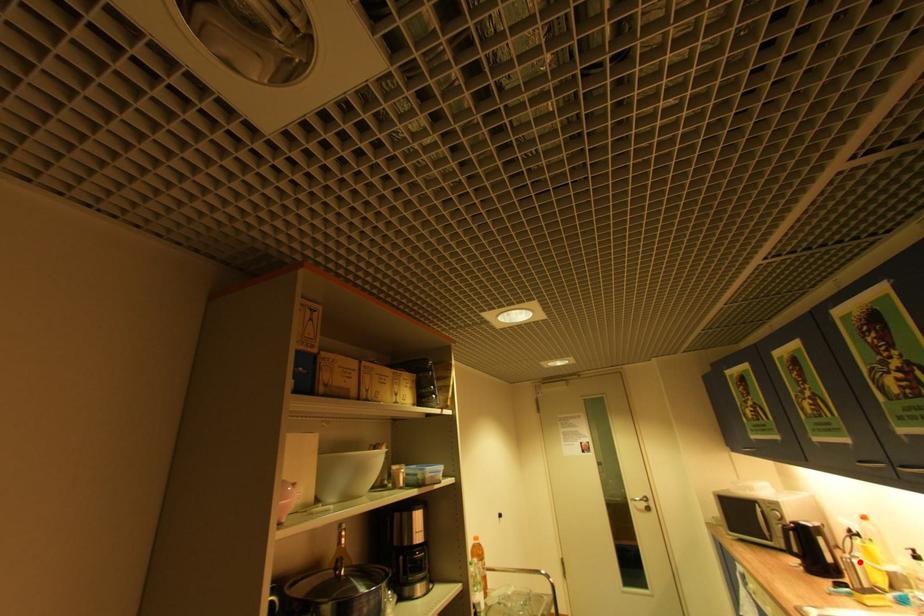
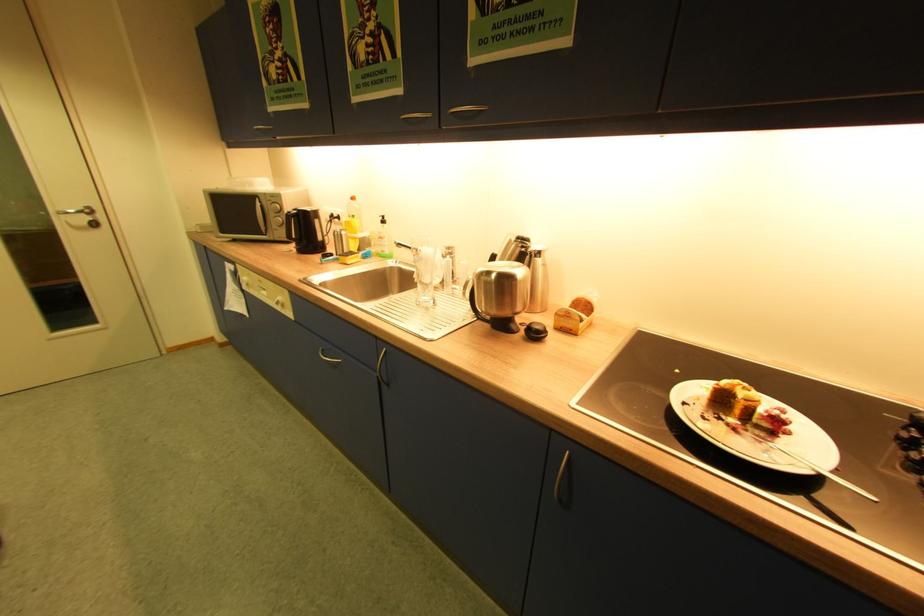
In the second image, find the point that corresponds to the highlighted location in the first image.

(348, 233)